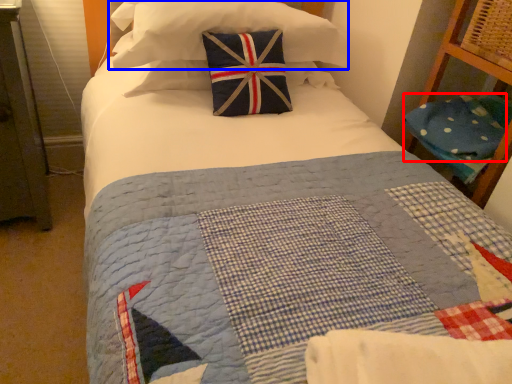
Question: Which object appears farthest to the camera in this image, pillow (highlighted by a red box) or pillow (highlighted by a blue box)?

Choices:
 (A) pillow
 (B) pillow

Answer: (A)